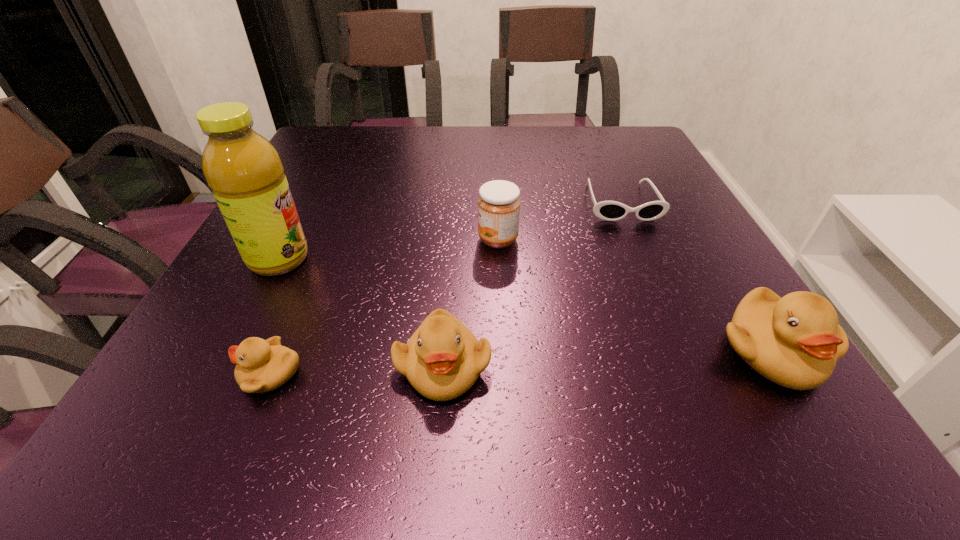
The image size is (960, 540). I want to click on object located at the near left corner, so click(262, 365).

Image resolution: width=960 pixels, height=540 pixels. Identify the location of object present at the near right corner. [x=795, y=341].

At what (x,y) coordinates should I click in order to perform the action: click on free space at the far edge of the desktop. Please return your answer as a coordinate pair (x, y). The image size is (960, 540). Looking at the image, I should click on point(520,129).

Locate an element on the screen. Image resolution: width=960 pixels, height=540 pixels. blank space at the near edge of the desktop is located at coordinates (382, 347).

In the image, there is a desktop. At what (x,y) coordinates should I click in order to perform the action: click on free region at the left edge. Please return your answer as a coordinate pair (x, y). Looking at the image, I should click on (324, 245).

Identify the location of free region at the right edge of the desktop. (627, 180).

Locate an element on the screen. This screenshot has height=540, width=960. vacant space at the far left corner is located at coordinates (367, 134).

Image resolution: width=960 pixels, height=540 pixels. Identify the location of free space at the near left corner of the desktop. (262, 333).

Locate an element on the screen. free space that is in between the farthest object and the tallest object is located at coordinates 450,231.

At what (x,y) coordinates should I click in order to perform the action: click on vacant region between the rightmost duckling and the farthest object. Please return your answer as a coordinate pair (x, y). The height and width of the screenshot is (540, 960). Looking at the image, I should click on (696, 277).